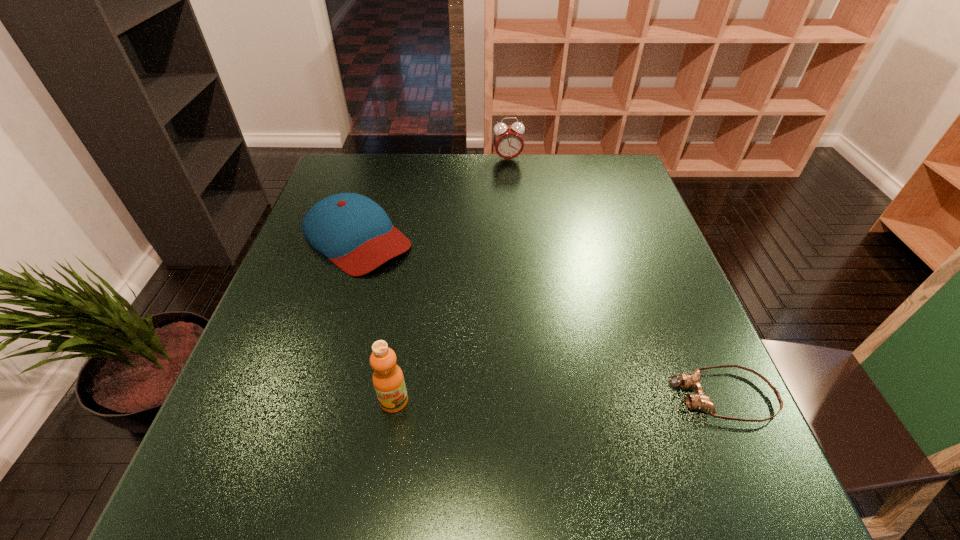
The image size is (960, 540). Find the location of `vacant space that satisfies the following two spatial constraints: 1. on the front side of the second shortest object; 2. on the front lenses and sides of the goggles`. vacant space that satisfies the following two spatial constraints: 1. on the front side of the second shortest object; 2. on the front lenses and sides of the goggles is located at coordinates (308, 396).